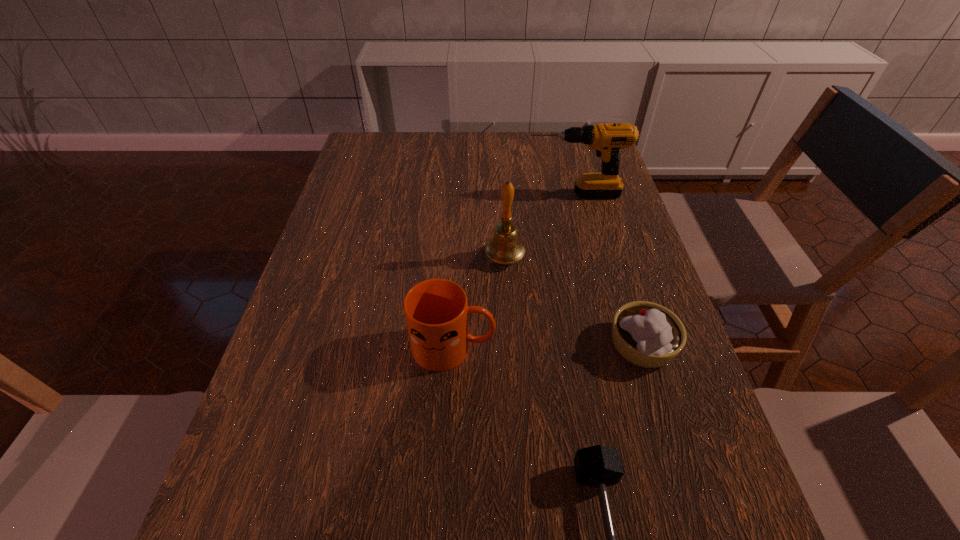
Where is `drill that is positioned at the right edge`? drill that is positioned at the right edge is located at coordinates (607, 140).

At what (x,y) coordinates should I click in order to perform the action: click on whipped cream present at the right edge. Please return your answer as a coordinate pair (x, y). Looking at the image, I should click on (646, 334).

I want to click on vacant space at the far edge, so click(542, 149).

Where is `vacant space at the left edge`? This screenshot has width=960, height=540. vacant space at the left edge is located at coordinates (334, 314).

The image size is (960, 540). Find the location of `free space at the right edge`. free space at the right edge is located at coordinates (599, 199).

You are a GUI agent. You are given a task and a screenshot of the screen. Output one action in this format:
    pyautogui.click(x=<x>, y=<y>)
    Task: Click on the free space at the far left corner of the desktop
    The height and width of the screenshot is (540, 960).
    Given the screenshot: What is the action you would take?
    pyautogui.click(x=382, y=156)

Find the location of a particular element. The height and width of the screenshot is (540, 960). vacant space at the far right corner of the desktop is located at coordinates (583, 158).

This screenshot has height=540, width=960. Find the location of `empty location between the mug and the farthest object`. empty location between the mug and the farthest object is located at coordinates [514, 271].

This screenshot has height=540, width=960. I want to click on unoccupied area between the second shortest object and the mug, so click(x=547, y=346).

You are a GUI agent. You are given a task and a screenshot of the screen. Output one action in this format:
    pyautogui.click(x=<x>, y=<y>)
    Task: Click on the free area in between the whipped cream and the third tallest object
    
    Given the screenshot: What is the action you would take?
    pyautogui.click(x=547, y=346)